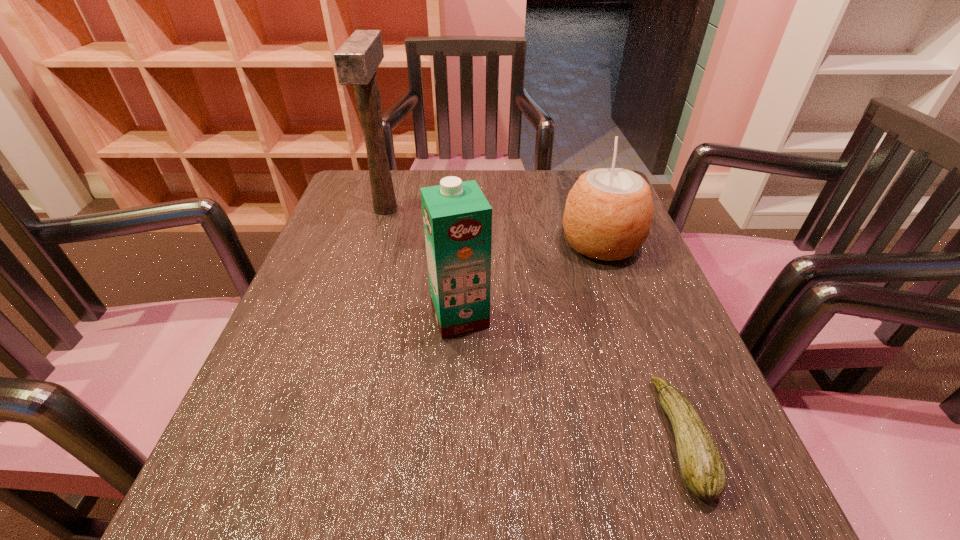
Identify the location of free spot at the far edge of the desktop. This screenshot has width=960, height=540. (542, 189).

Identify the location of free region at the near edge. (422, 496).

I want to click on free space at the left edge of the desktop, so click(322, 391).

You are a GUI agent. You are given a task and a screenshot of the screen. Output one action in this format:
    pyautogui.click(x=<x>, y=<y>)
    Task: Click on the vacant space at the right edge of the desktop
    The image size is (960, 540).
    Given the screenshot: What is the action you would take?
    pyautogui.click(x=654, y=270)

This screenshot has height=540, width=960. I want to click on free spot at the far left corner of the desktop, so click(x=400, y=201).

Identify the location of vacant region at the far right corner of the desktop. This screenshot has height=540, width=960. (561, 170).

This screenshot has height=540, width=960. What are the coordinates of `free region at the near right corner` in the screenshot? It's located at (660, 501).

Locate an element on the screen. Image resolution: width=960 pixels, height=540 pixels. vacant point located between the leftmost object and the second object from left to right is located at coordinates (422, 262).

This screenshot has height=540, width=960. In order to click on free space between the leftmost object and the shortest object in this screenshot , I will do `click(534, 323)`.

I want to click on free spot between the nearest object and the third tallest object, so click(x=641, y=341).